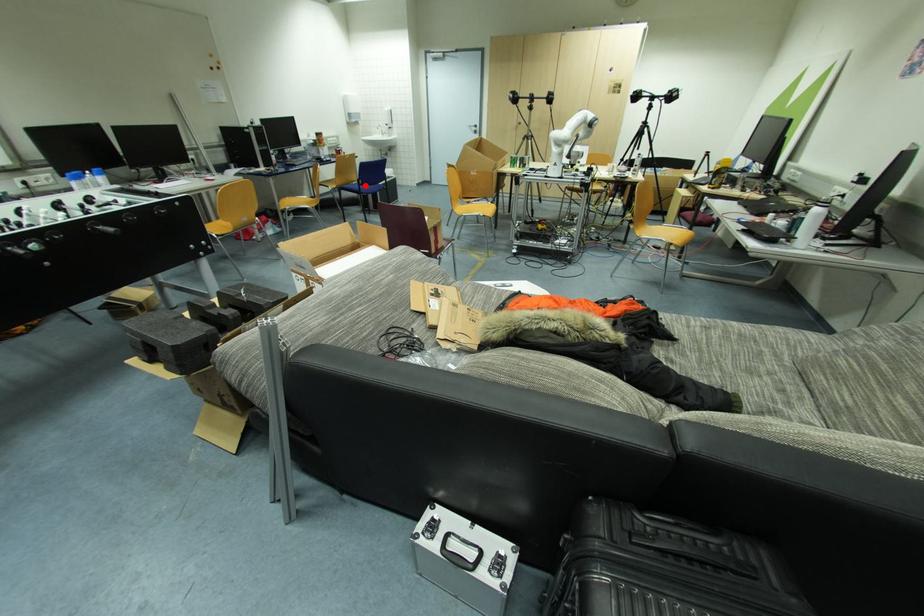
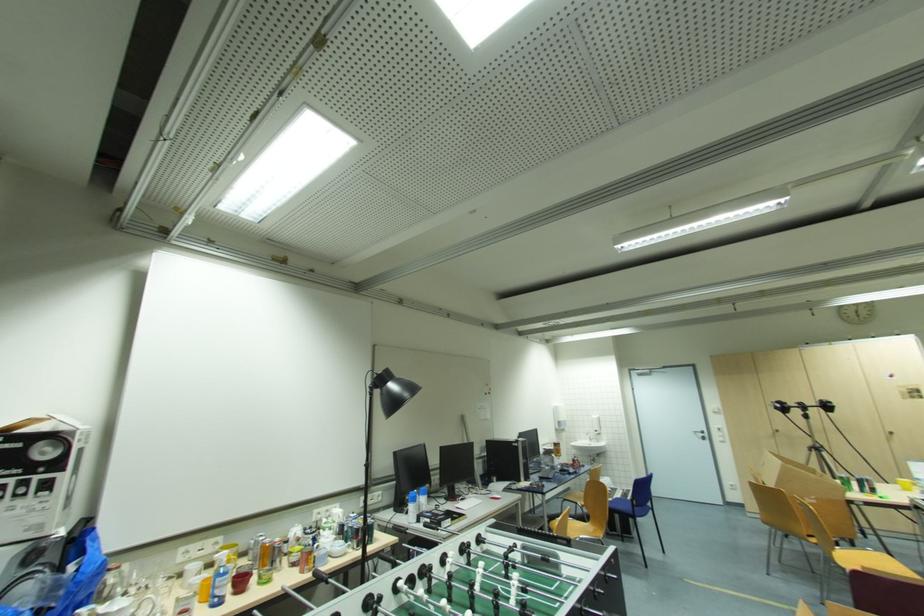
Locate, in the second image, the point that corresponds to the highlighted location in the first image.

(639, 506)